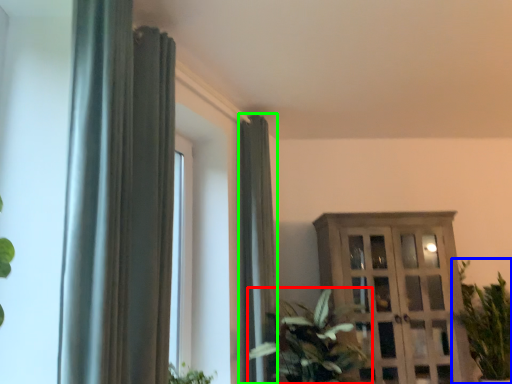
Question: Which object is positioned closest to houseplant (highlighted by a red box)? Select from houseplant (highlighted by a blue box) and curtain (highlighted by a green box).

Choices:
 (A) houseplant
 (B) curtain

Answer: (B)